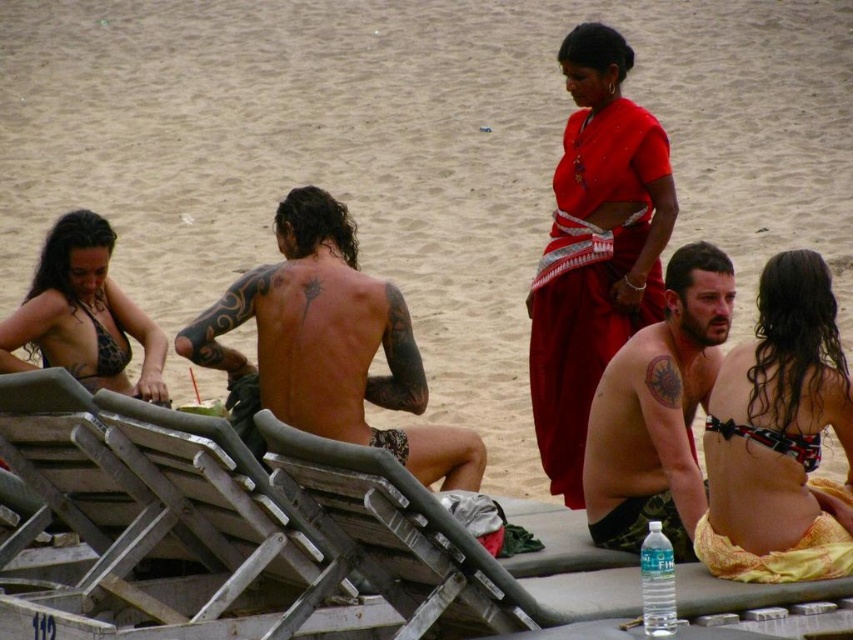
Question: Is shiny metallic tattoo at center further to the viewer compared to leopard print bikini top at lower left?

Choices:
 (A) yes
 (B) no

Answer: (B)

Question: Among these points, which one is nearest to the camera?

Choices:
 (A) (67, 356)
 (B) (573, 476)

Answer: (A)

Question: Can you confirm if red silk sari at center is positioned below printed bikini top at center?

Choices:
 (A) yes
 (B) no

Answer: (B)

Question: Which of the following is the farthest from the observer?

Choices:
 (A) printed bikini top at center
 (B) leopard print bikini top at lower left
 (C) red silk sari at center

Answer: (C)

Question: Estimate the real-world distances between objects in this image. Which object is closer to the shiny metallic tattoo at center?

Choices:
 (A) wooden beach chair at center
 (B) tattooed skin at center

Answer: (A)

Question: Is tattooed skin at center bigger than leopard print bikini top at lower left?

Choices:
 (A) yes
 (B) no

Answer: (B)